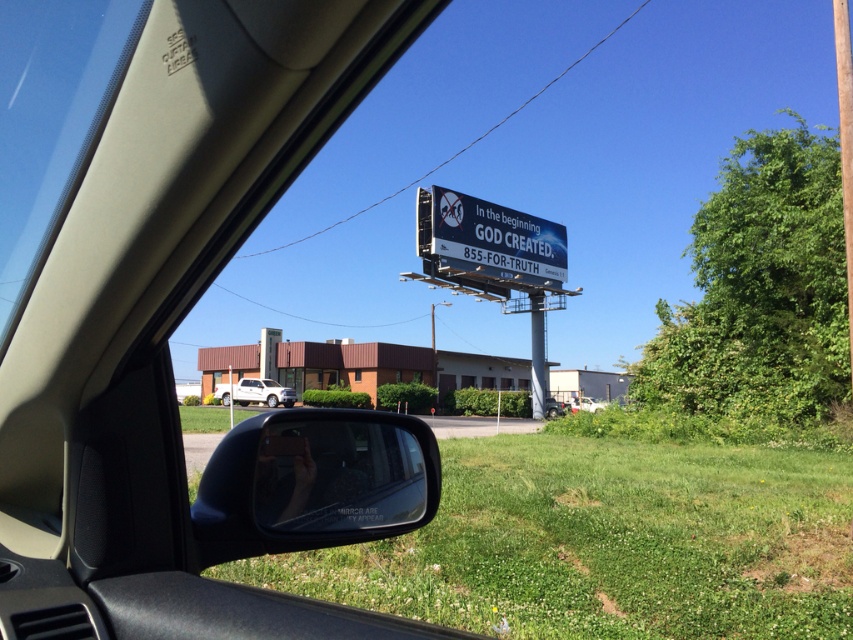
Question: Does white plastic billboard at upper center appear under white matte truck at center?

Choices:
 (A) yes
 (B) no

Answer: (B)

Question: Can you confirm if black glossy view mirror at lower center is positioned below white plastic billboard at upper center?

Choices:
 (A) yes
 (B) no

Answer: (A)

Question: Is white plastic billboard at upper center in front of white matte car at center?

Choices:
 (A) no
 (B) yes

Answer: (A)

Question: Among these objects, which one is nearest to the camera?

Choices:
 (A) white matte truck at center
 (B) white plastic billboard at upper center
 (C) white matte car at center
 (D) black glossy view mirror at lower center

Answer: (D)

Question: Among these objects, which one is farthest from the camera?

Choices:
 (A) black glossy view mirror at lower center
 (B) white matte car at center
 (C) white matte truck at center
 (D) white plastic billboard at upper center

Answer: (C)

Question: Which of the following is the farthest from the observer?

Choices:
 (A) (576, 406)
 (B) (288, 529)
 (C) (523, 253)
 (D) (231, 392)

Answer: (D)